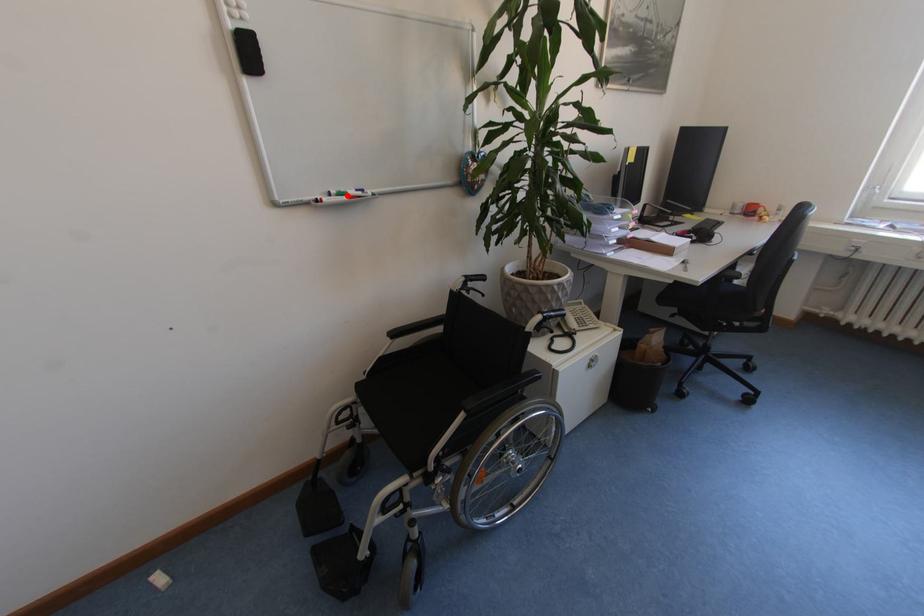
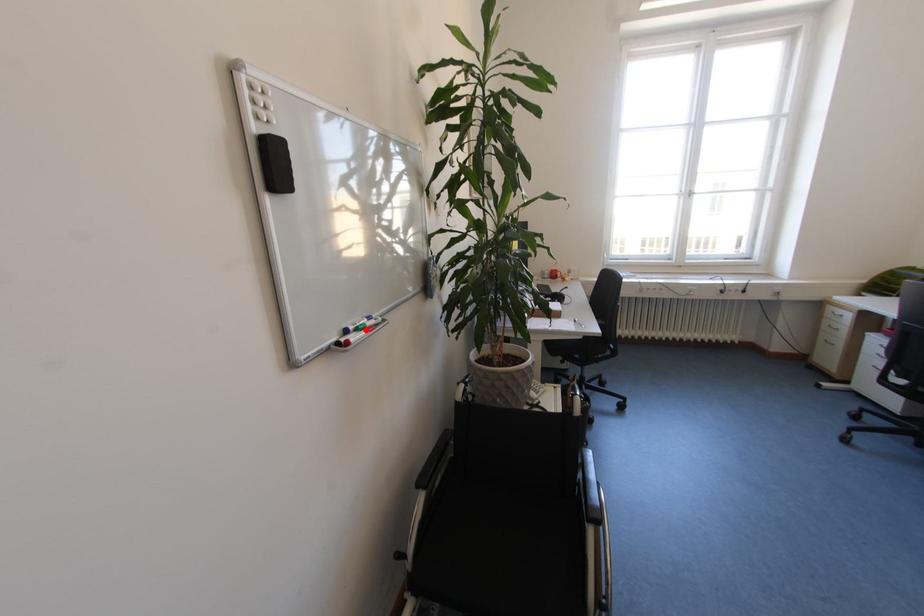
I am providing you with two images of the same scene from different viewpoints. A red point is marked on the first image and another point is marked on the second image. Are the points marked in image1 and image2 representing the same 3D position?

Yes